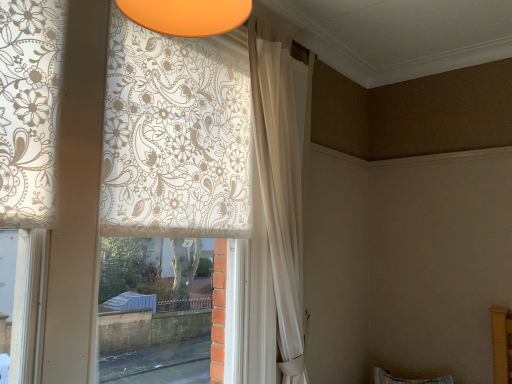
Question: Does white sheer curtain at upper center, the 1th curtain when ordered from right to left, appear on the right side of white floral-patterned curtain at upper left, arranged as the 1th curtain when viewed from the left?

Choices:
 (A) no
 (B) yes

Answer: (B)

Question: From the image's perspective, is white sheer curtain at upper center, the 1th curtain when ordered from right to left, located above white floral-patterned curtain at upper left, arranged as the 1th curtain when viewed from the left?

Choices:
 (A) no
 (B) yes

Answer: (A)

Question: Considering the relative sizes of white sheer curtain at upper center, the 1th curtain when ordered from right to left, and white floral-patterned curtain at upper left, the second curtain viewed from the right, in the image provided, is white sheer curtain at upper center, the 1th curtain when ordered from right to left, thinner than white floral-patterned curtain at upper left, the second curtain viewed from the right,?

Choices:
 (A) no
 (B) yes

Answer: (B)

Question: From the image's perspective, does white sheer curtain at upper center, which appears as the second curtain when viewed from the left, appear lower than white floral-patterned curtain at upper left, the second curtain viewed from the right?

Choices:
 (A) yes
 (B) no

Answer: (A)

Question: From a real-world perspective, is white sheer curtain at upper center, the 1th curtain when ordered from right to left, under white floral-patterned curtain at upper left, arranged as the 1th curtain when viewed from the left?

Choices:
 (A) yes
 (B) no

Answer: (B)

Question: Does white sheer curtain at upper center, which appears as the second curtain when viewed from the left, turn towards white floral-patterned curtain at upper left, arranged as the 1th curtain when viewed from the left?

Choices:
 (A) yes
 (B) no

Answer: (B)

Question: From a real-world perspective, is white floral-patterned curtain at upper left, arranged as the 1th curtain when viewed from the left, physically above white sheer curtain at upper center, which appears as the second curtain when viewed from the left?

Choices:
 (A) yes
 (B) no

Answer: (B)

Question: Can you confirm if white floral-patterned curtain at upper left, arranged as the 1th curtain when viewed from the left, is shorter than white sheer curtain at upper center, the 1th curtain when ordered from right to left?

Choices:
 (A) yes
 (B) no

Answer: (A)

Question: Considering the relative sizes of white floral-patterned curtain at upper left, the second curtain viewed from the right, and white sheer curtain at upper center, the 1th curtain when ordered from right to left, in the image provided, is white floral-patterned curtain at upper left, the second curtain viewed from the right, wider than white sheer curtain at upper center, the 1th curtain when ordered from right to left,?

Choices:
 (A) no
 (B) yes

Answer: (B)

Question: Does white floral-patterned curtain at upper left, arranged as the 1th curtain when viewed from the left, have a smaller size compared to white sheer curtain at upper center, the 1th curtain when ordered from right to left?

Choices:
 (A) yes
 (B) no

Answer: (B)

Question: Is white floral-patterned curtain at upper left, arranged as the 1th curtain when viewed from the left, located outside white sheer curtain at upper center, the 1th curtain when ordered from right to left?

Choices:
 (A) yes
 (B) no

Answer: (A)

Question: Does white floral-patterned curtain at upper left, arranged as the 1th curtain when viewed from the left, turn towards white sheer curtain at upper center, the 1th curtain when ordered from right to left?

Choices:
 (A) no
 (B) yes

Answer: (B)

Question: Is point (131, 36) positioned closer to the camera than point (259, 147)?

Choices:
 (A) farther
 (B) closer

Answer: (B)